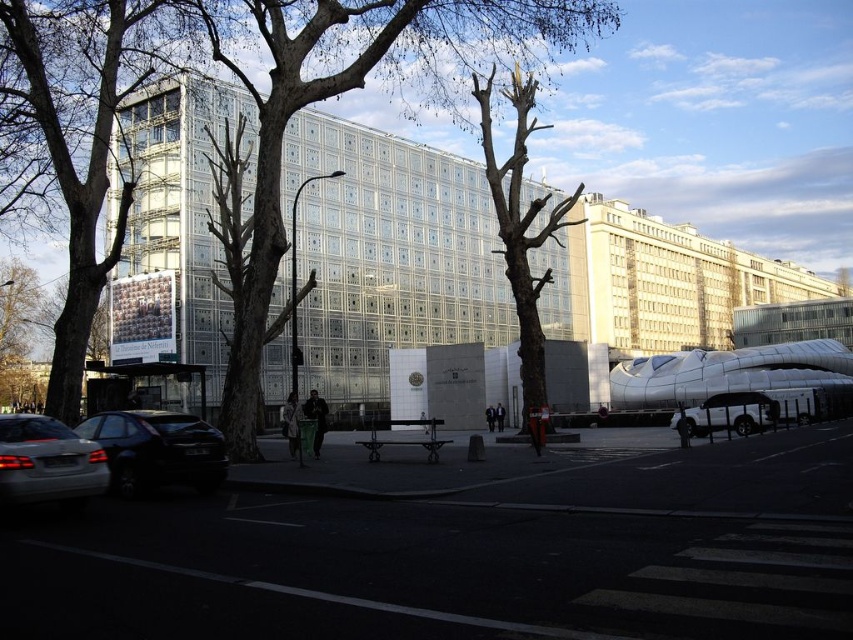
The width and height of the screenshot is (853, 640). In order to click on green leafless tree at left in this screenshot , I will do `click(86, 134)`.

This screenshot has width=853, height=640. What do you see at coordinates (86, 134) in the screenshot? I see `green leafless tree at left` at bounding box center [86, 134].

Which is in front, point (73, 81) or point (76, 458)?

Point (76, 458)

What are the coordinates of `green leafless tree at left` in the screenshot? It's located at (86, 134).

Is brown bark tree at center shorter than silver metallic car at lower left?

In fact, brown bark tree at center may be taller than silver metallic car at lower left.

Identify the location of brown bark tree at center. 256,115.

Find the location of `brown bark tree at center`. brown bark tree at center is located at coordinates point(256,115).

Between brown bark tree at center and shiny black hatchback at lower left, which one is positioned higher?

Positioned higher is brown bark tree at center.

Is point (259, 236) positioned in front of point (140, 474)?

No, it is not.

In the scene shown: Measure the distance between brown bark tree at center and camera.

A distance of 20.40 meters exists between brown bark tree at center and camera.

The width and height of the screenshot is (853, 640). I want to click on brown bark tree at center, so click(256, 115).